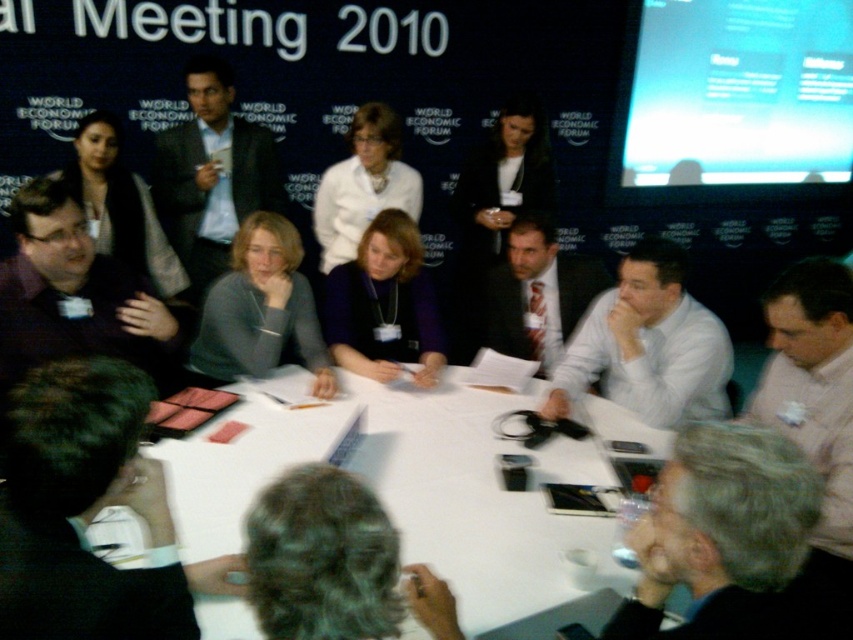
Looking at this image, who is positioned more to the right, gray matte sweater at center or purple matte jacket at center?

Positioned to the right is purple matte jacket at center.

Between gray matte sweater at center and purple matte jacket at center, which one is positioned lower?

purple matte jacket at center

Locate an element on the screen. The width and height of the screenshot is (853, 640). gray matte sweater at center is located at coordinates (260, 308).

Between point (553, 410) and point (206, 356), which one is positioned behind?

The point (206, 356) is behind.

Identify the location of white shirt at center. Image resolution: width=853 pixels, height=640 pixels. (647, 346).

Identify the location of green curly hair at lower center. (322, 557).

Does green curly hair at lower center appear under purple matte jacket at center?

Indeed, green curly hair at lower center is positioned under purple matte jacket at center.

Who is more forward, (421, 566) or (383, 376)?

Point (421, 566) is more forward.

Image resolution: width=853 pixels, height=640 pixels. Find the location of `green curly hair at lower center`. green curly hair at lower center is located at coordinates (322, 557).